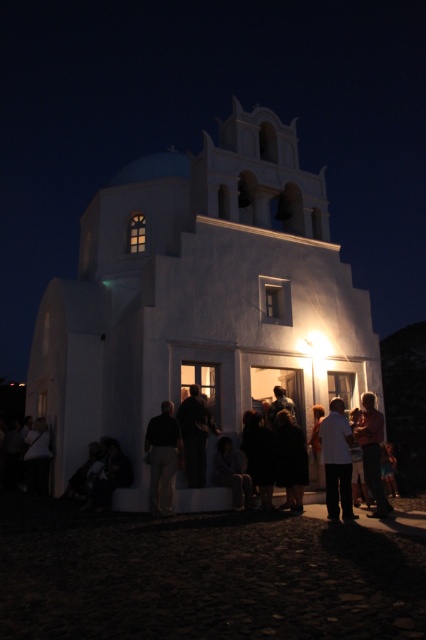
Consider the image. Does white matte church at center have a lesser width compared to dark clothing crowd at center?

Incorrect, white matte church at center's width is not less than dark clothing crowd at center's.

Does white matte church at center have a lesser height compared to dark clothing crowd at center?

In fact, white matte church at center may be taller than dark clothing crowd at center.

Between point (201, 170) and point (126, 493), which one is positioned in front?

Point (126, 493) is more forward.

Identify the location of white matte church at center. The image size is (426, 640). (199, 298).

Which is more to the left, white matte church at center or dark gray pants at center?

white matte church at center

Who is more forward, (310, 269) or (149, 433)?

Point (149, 433) is more forward.

Find the location of a particular element. This screenshot has width=426, height=640. white matte church at center is located at coordinates (199, 298).

Can you confirm if white matte shirt at center is taller than matte pink shirt at right?

No, white matte shirt at center is not taller than matte pink shirt at right.

Which is more to the left, white matte shirt at center or matte pink shirt at right?

From the viewer's perspective, white matte shirt at center appears more on the left side.

Which is behind, point (353, 516) or point (365, 404)?

Point (365, 404)

At what (x,y) coordinates should I click in order to perform the action: click on white matte shirt at center. Please return your answer as a coordinate pair (x, y). The width and height of the screenshot is (426, 640). Looking at the image, I should click on (336, 460).